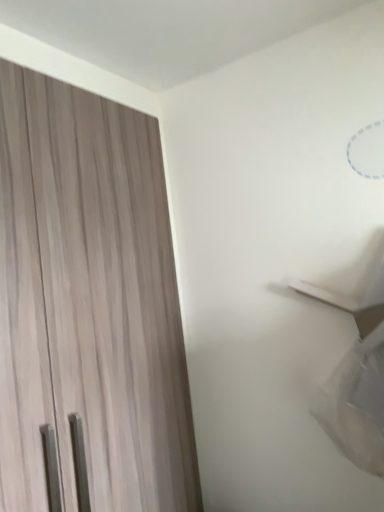
You are a GUI agent. You are given a task and a screenshot of the screen. Output one action in this format:
    pyautogui.click(x=<x>, y=<y>)
    Task: Click on the free space above matte wood door at left (from a real-world perspective)
    This screenshot has width=384, height=512.
    Given the screenshot: What is the action you would take?
    pyautogui.click(x=64, y=73)